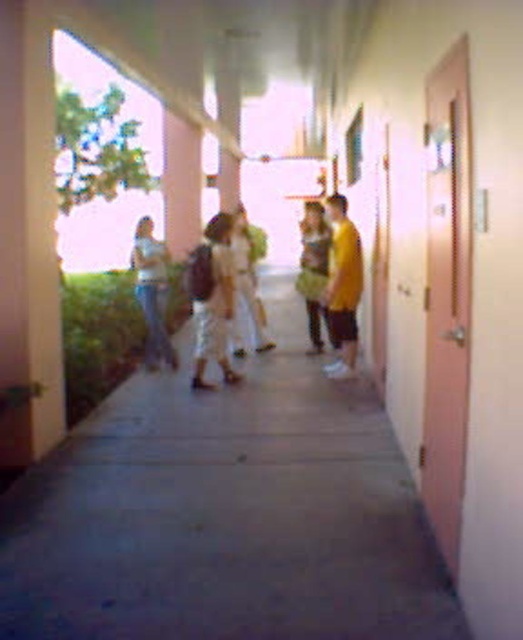
Is point (208, 266) closer to camera compared to point (156, 326)?

Yes.

Who is shorter, matte brown backpack at center or denim jeans at left?

With less height is denim jeans at left.

The image size is (523, 640). What are the coordinates of `matte brown backpack at center` in the screenshot? It's located at (211, 298).